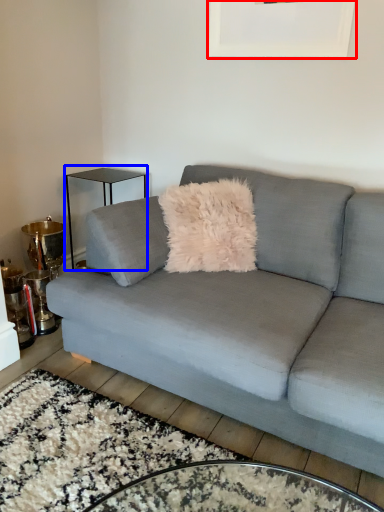
Question: Among these objects, which one is farthest to the camera, picture frame (highlighted by a red box) or table (highlighted by a blue box)?

Choices:
 (A) picture frame
 (B) table

Answer: (B)